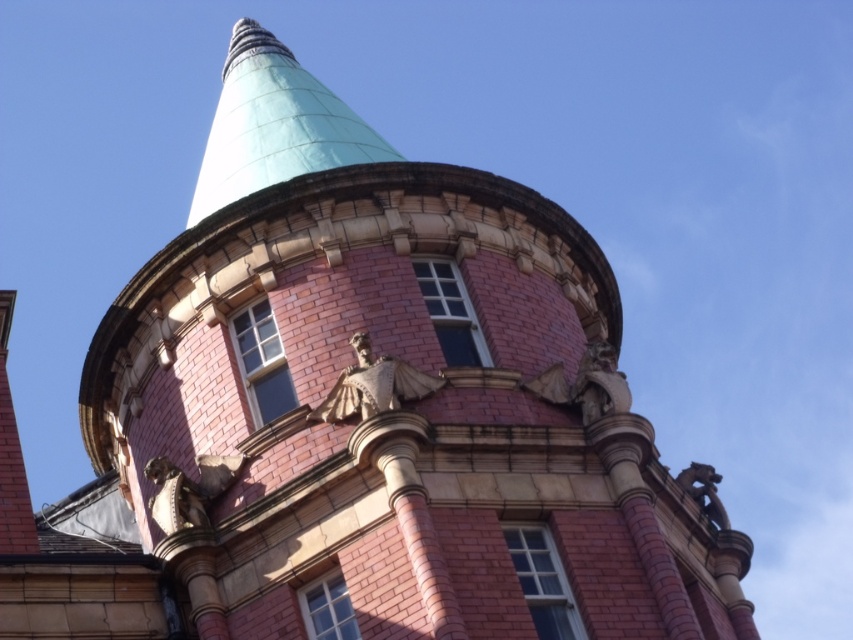
In the scene shown: You are an architect examining the building facade. The gold metallic statue at center is located at coordinates 0.603, 0.438. If you were to place a new rectangular window with dimensions 0.15 by 0.20 on the facade, what is the safest coordinate to place it so it doesn not overlap with the statue?

The safest coordinate to place the new rectangular window would be at point (426, 256) to ensure it does not overlap with the gold metallic statue at center at point (373, 385).

You are an art curator planning to install a new sculpture between the gold metallic statue at center and the polished bronze statue at upper center. The sculpture requires a minimum of 5 meters of space between it and the existing statues. Is the current distance sufficient for this installation?

The gold metallic statue at center and the polished bronze statue at upper center are 4.68 meters apart. Since the required minimum space is 5 meters, the current distance is insufficient for the installation.